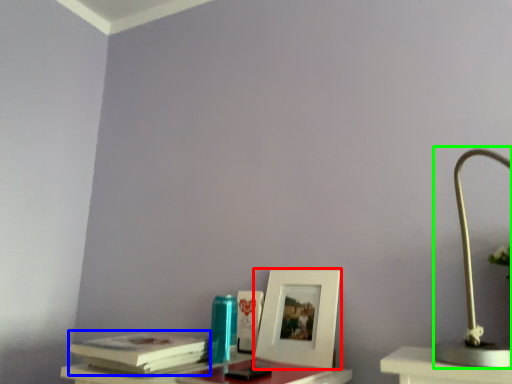
Question: Estimate the real-world distances between objects in this image. Which object is farther from picture frame (highlighted by a red box), paperback book (highlighted by a blue box) or lamp (highlighted by a green box)?

Choices:
 (A) paperback book
 (B) lamp

Answer: (B)